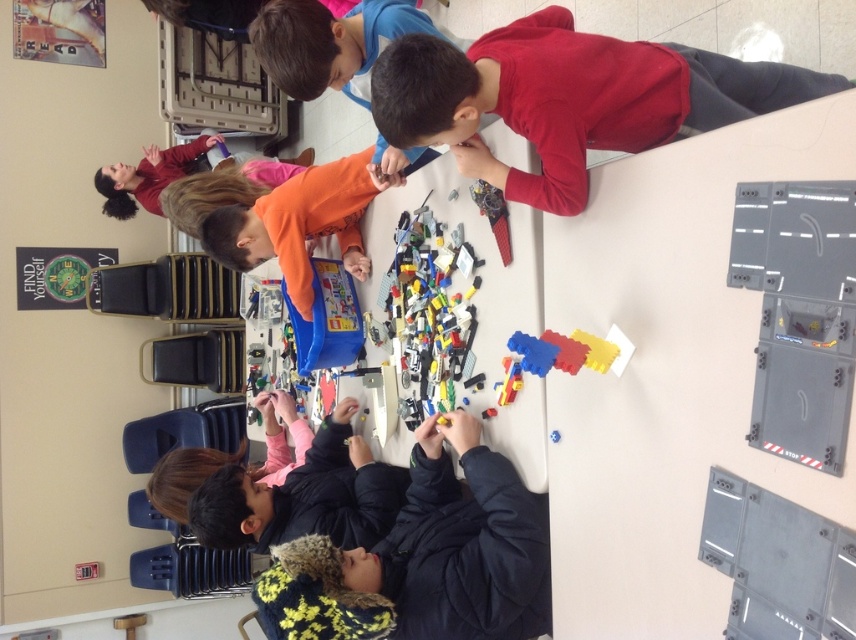
You are a teacher in the classroom and want to hand out a new LEGO set to the children. You are standing at the front of the classroom. Which child should you walk towards first, the one wearing the red matte shirt at upper right or the dark blue jacket at lower center, if you want to reach the closest one first?

The dark blue jacket at lower center is closer to you than the red matte shirt at upper right, so you should walk towards the dark blue jacket at lower center first.

You are a teacher observing the LEGO activity. You notice two children wearing red matte shirt at upper right and orange matte shirt at upper center. Which child is wearing a larger shirt?

The red matte shirt at upper right has a larger size compared to the orange matte shirt at upper center, so the child wearing the red matte shirt at upper right has a larger shirt.

You are a teacher observing the children at the table. You notice the red matte shirt at upper right and the dark blue jacket at lower center. Which child is shorter in height?

The red matte shirt at upper right is not as tall as dark blue jacket at lower center, so the child wearing the red matte shirt at upper right is shorter in height.